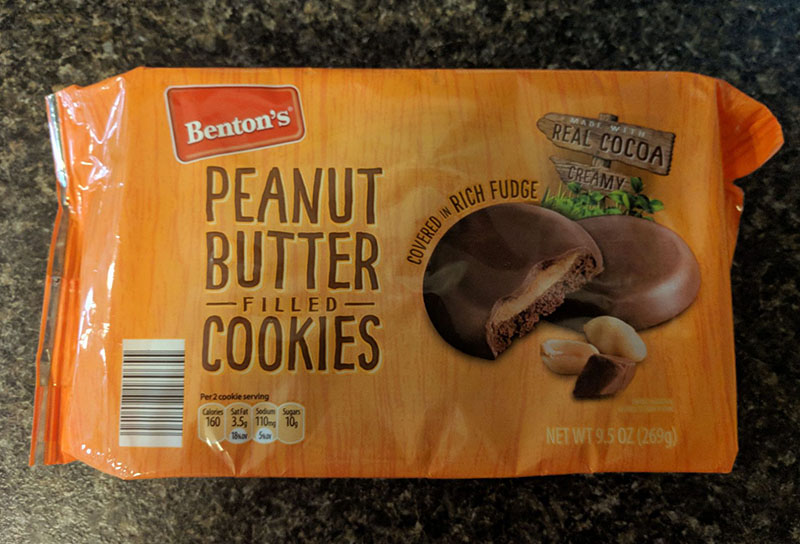
The image size is (800, 544). What are the coordinates of `brown and black counter top` in the screenshot? It's located at (26, 189).